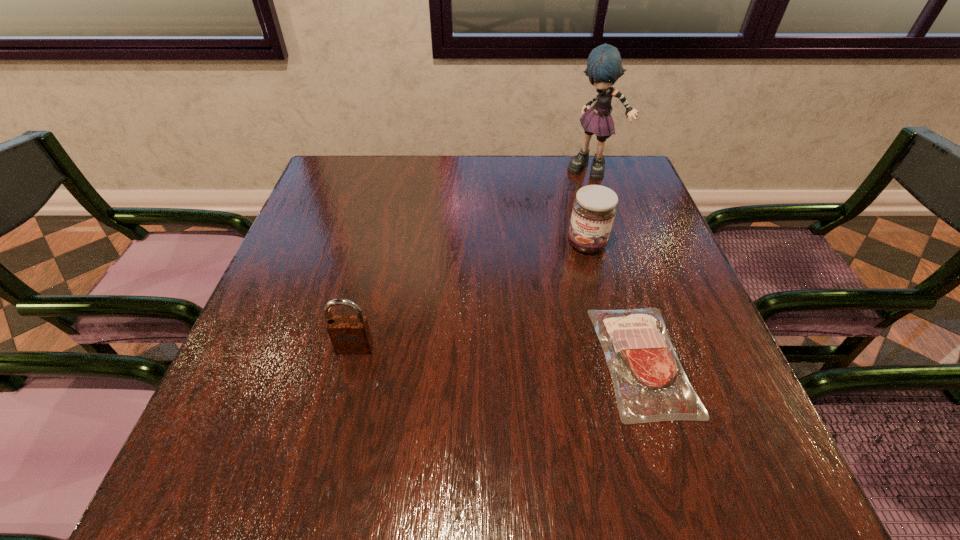
I want to click on padlock, so click(350, 334).

I want to click on the shortest object, so click(650, 385).

Find the location of `the farthest object`. the farthest object is located at coordinates (604, 66).

At what (x,y) coordinates should I click in order to perform the action: click on the tallest object. Please return your answer as a coordinate pair (x, y). This screenshot has height=540, width=960. Looking at the image, I should click on (604, 66).

At what (x,y) coordinates should I click in order to perform the action: click on jam. Please return your answer as a coordinate pair (x, y). Looking at the image, I should click on 594,209.

Locate an element on the screen. free space located on the front-facing side of the leftmost object is located at coordinates (339, 413).

Locate an element on the screen. The width and height of the screenshot is (960, 540). free space located 0.070m on the back of the steak is located at coordinates (618, 285).

This screenshot has height=540, width=960. In order to click on vacant position located 0.210m on the front-facing side of the rag doll in this screenshot , I will do `click(575, 224)`.

Find the location of a particular element. This screenshot has width=960, height=540. free space located 0.160m on the front-facing side of the rag doll is located at coordinates (578, 212).

The image size is (960, 540). In order to click on vacant space located on the front-facing side of the rag doll in this screenshot , I will do `click(576, 221)`.